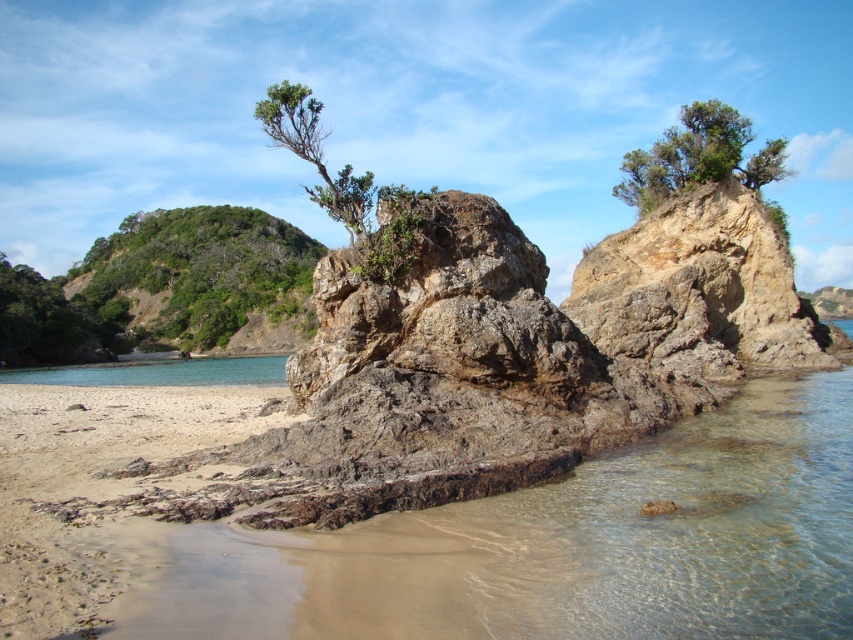
You are a hiker standing at the base of the rock formation. You notice two plants growing on the rock face. Which one is closer to you, the green leafy tree at upper left or the green leafy shrub at upper center?

The green leafy tree at upper left is closer to you because it is positioned further to the viewer than the green leafy shrub at upper center.

You are a hiker standing at the origin point of the coordinate system. The origin is at the bottom left corner of the image. You want to take a photo of the green leafy tree at upper left. In which direction should you move to get closer to the tree?

The green leafy tree at upper left is located at coordinate point 0.428 on the x axis and 0.230 on the y axis. Since the origin is at the bottom left corner, moving towards the right increases the x value and moving upwards increases the y value. To reach the tree, you should move northeast, combining right and upward movements.